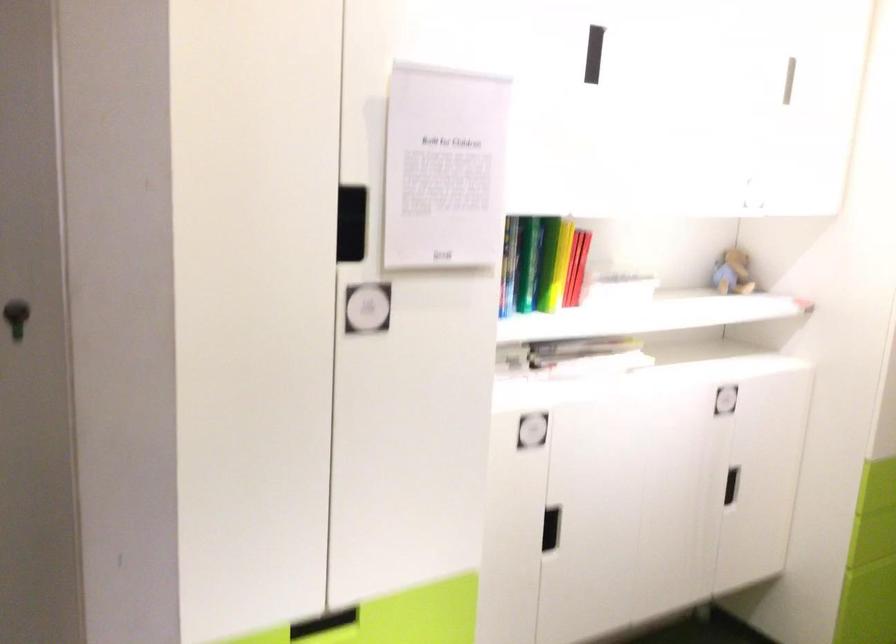
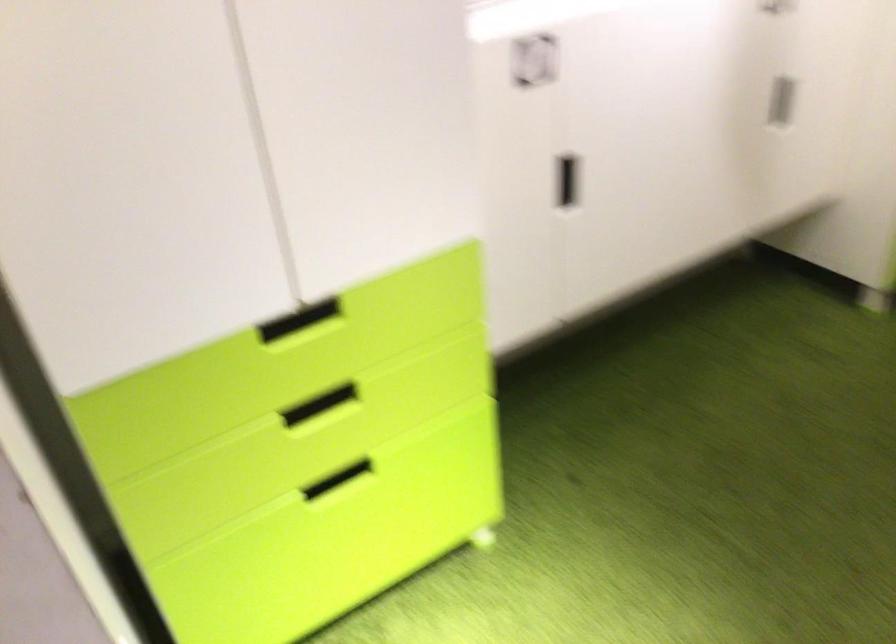
Question: What movement of the cameraman would produce the second image?

Choices:
 (A) Left
 (B) Right
 (C) Forward
 (D) Backward

Answer: (C)